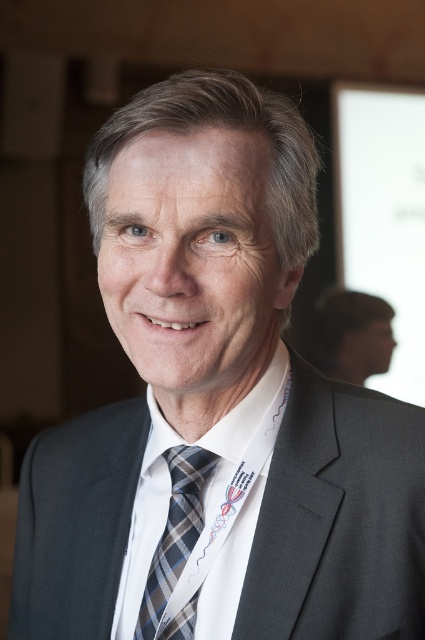
In the image, there is a point labeled as point (x=232, y=502). What object is located at that point?

The white woven dress shirt at center is located at point (x=232, y=502).